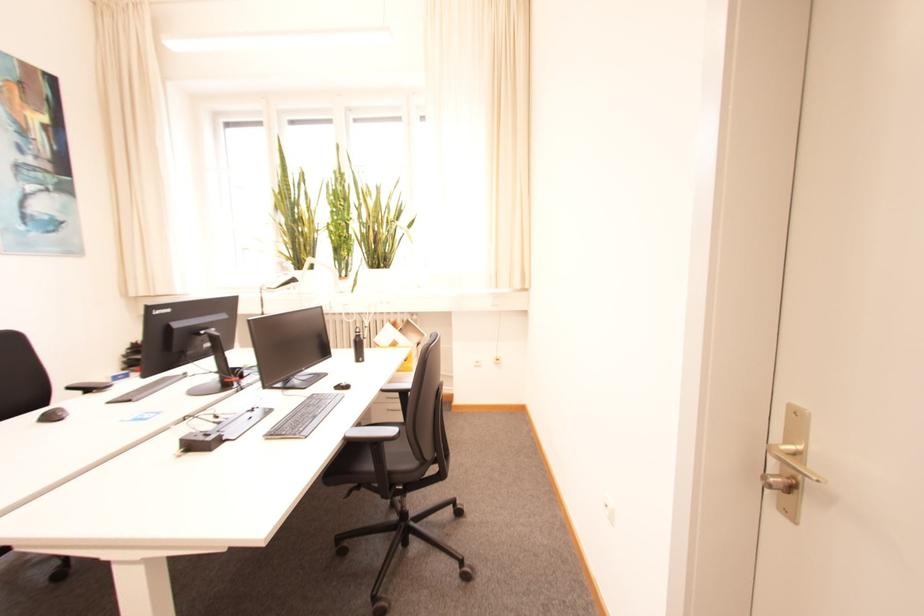
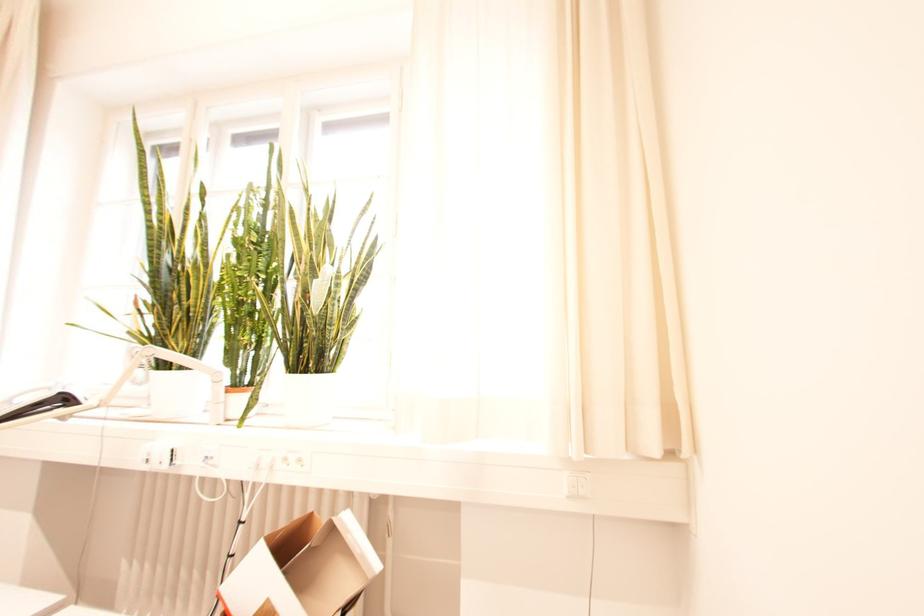
Question: In a continuous first-person perspective shot, in which direction is the camera moving?

Choices:
 (A) Left
 (B) Right
 (C) Forward
 (D) Backward

Answer: (C)